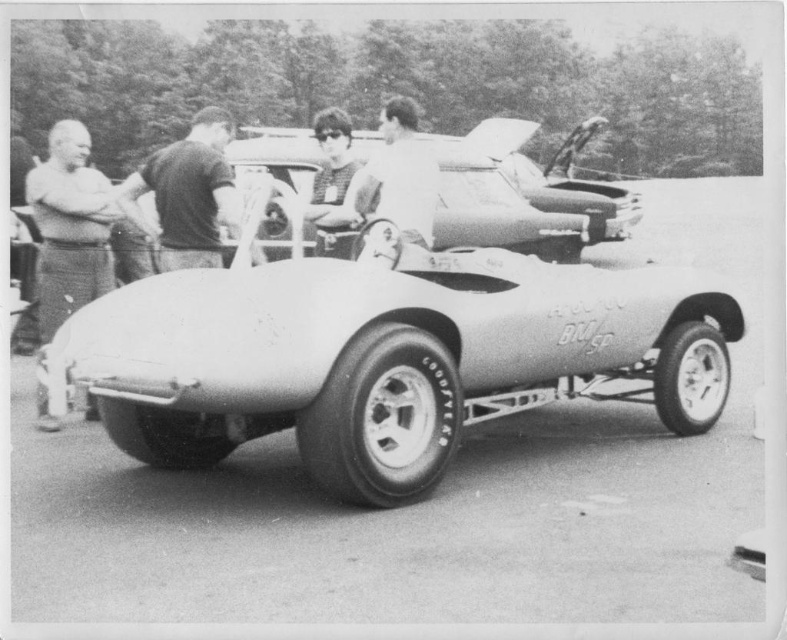
Question: Can you confirm if metallic silver sports car at center is positioned above shiny metallic car at center?

Choices:
 (A) no
 (B) yes

Answer: (A)

Question: Which object is positioned closest to the dark gray shirt at center?

Choices:
 (A) metallic silver sports car at center
 (B) shiny metallic car at center
 (C) smooth leather jacket at center

Answer: (A)

Question: Among these points, which one is farthest from the camera?

Choices:
 (A) (405, 115)
 (B) (183, 227)
 (C) (54, 342)

Answer: (B)

Question: In this image, where is shiny metallic car at center located relative to dark gray shirt at center?

Choices:
 (A) above
 (B) below

Answer: (A)

Question: Does shiny metallic car at center come behind dark gray shirt at center?

Choices:
 (A) no
 (B) yes

Answer: (B)

Question: Which of these objects is positioned farthest from the metallic silver sports car at center?

Choices:
 (A) shiny metallic car at center
 (B) smooth leather jacket at center
 (C) dark gray shirt at center

Answer: (A)